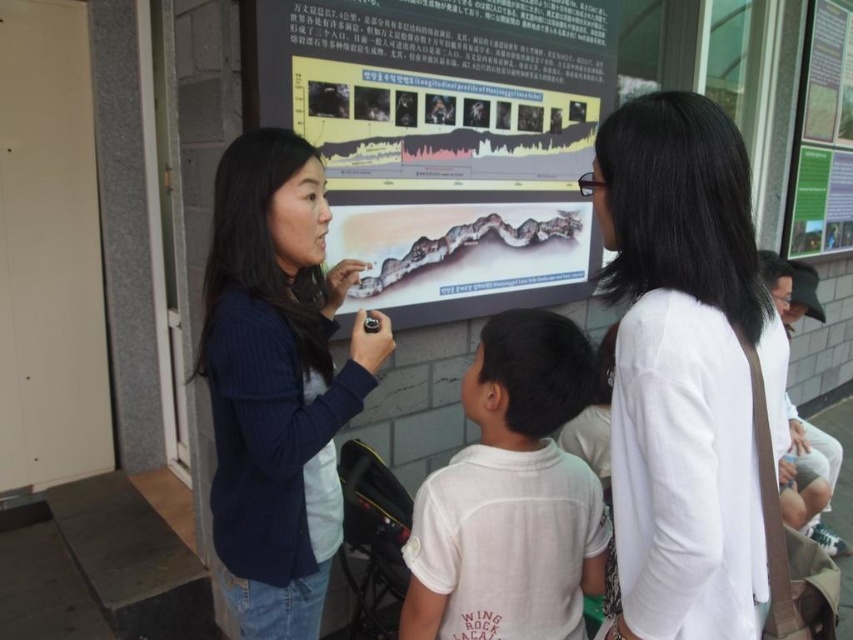
What do you see at coordinates (447, 140) in the screenshot? I see `matte plastic poster at center` at bounding box center [447, 140].

Locate an element on the screen. This screenshot has width=853, height=640. matte plastic poster at center is located at coordinates (447, 140).

I want to click on matte plastic poster at center, so click(447, 140).

In the scene shown: Who is higher up, white cotton shirt at center or green paper at upper right?

green paper at upper right is above.

Between white cotton shirt at center and green paper at upper right, which one has more height?

green paper at upper right

Who is more forward, [430,522] or [827,99]?

Positioned in front is point [430,522].

This screenshot has width=853, height=640. I want to click on white cotton shirt at center, so click(509, 497).

Which is above, navy blue sweater at center or green paper at upper right?

green paper at upper right is higher up.

Is navy blue sweater at center closer to the viewer compared to green paper at upper right?

Yes, navy blue sweater at center is in front of green paper at upper right.

The image size is (853, 640). Find the location of `navy blue sweater at center`. navy blue sweater at center is located at coordinates (277, 381).